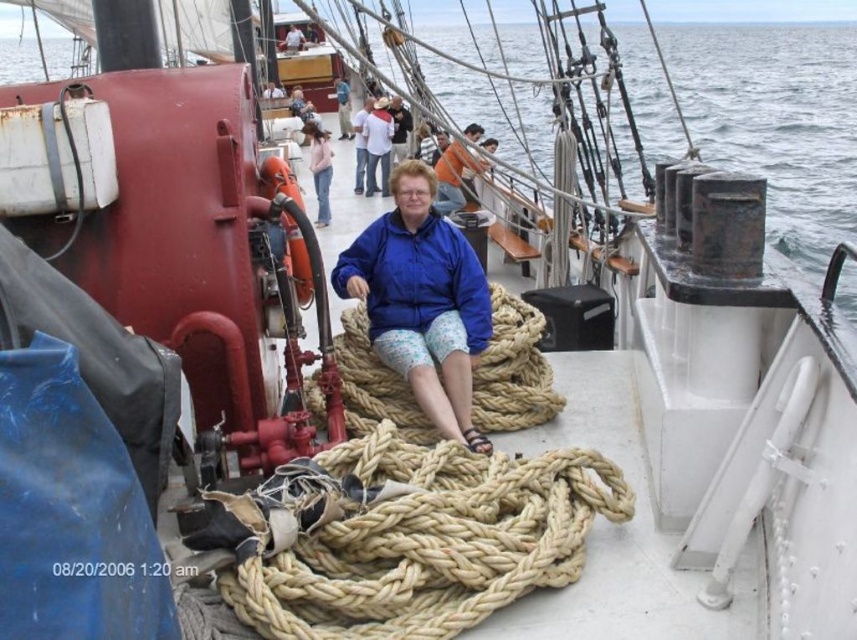
Does white cotton shirt at center have a lesser width compared to blue fabric jacket at center?

Indeed, white cotton shirt at center has a lesser width compared to blue fabric jacket at center.

Which is below, white cotton shirt at center or blue fabric jacket at center?

→ white cotton shirt at center is lower down.

Image resolution: width=857 pixels, height=640 pixels. What do you see at coordinates (376, 145) in the screenshot? I see `white cotton shirt at center` at bounding box center [376, 145].

Find the location of `white cotton shirt at center`. white cotton shirt at center is located at coordinates (376, 145).

Does natural tan rope at center have a lesser width compared to white cotton shirt at center?

No.

Is point (363, 337) closer to viewer compared to point (378, 97)?

That is True.

The image size is (857, 640). What are the coordinates of `natural tan rope at center` in the screenshot? It's located at point(513,371).

Who is positioned more to the right, blue matte jacket at center or natural tan rope at center?

natural tan rope at center is more to the right.

Is point (458, 317) closer to viewer compared to point (504, 420)?

That is False.

Identify the location of blue matte jacket at center. The height and width of the screenshot is (640, 857). (421, 300).